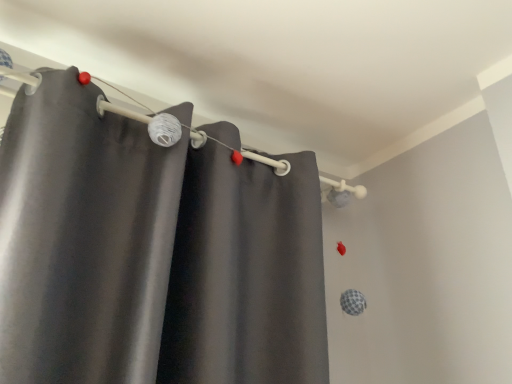
The width and height of the screenshot is (512, 384). I want to click on satin curtain at upper center, so click(137, 120).

Measure the distance between satin curtain at upper center and camera.

The depth of satin curtain at upper center is 35.43 inches.

What do you see at coordinates (137, 120) in the screenshot?
I see `satin curtain at upper center` at bounding box center [137, 120].

Locate an element on the screen. This screenshot has width=512, height=384. satin curtain at upper center is located at coordinates (137, 120).